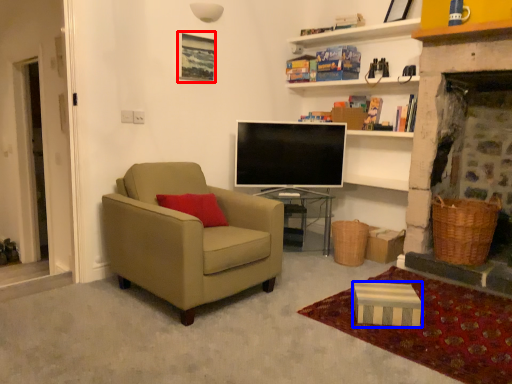
Question: Which object appears farthest to the camera in this image, picture frame (highlighted by a red box) or box (highlighted by a blue box)?

Choices:
 (A) picture frame
 (B) box

Answer: (A)